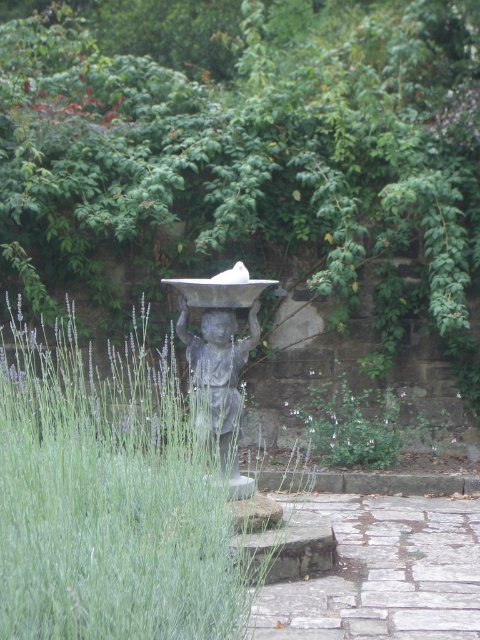
Who is taller, green grass at center or paved stone path at center?

green grass at center

Is point (96, 433) closer to viewer compared to point (414, 513)?

Yes.

Locate an element on the screen. The image size is (480, 640). green grass at center is located at coordinates (108, 497).

Who is positioned more to the right, bronze statue at center or green leafy plant at center?

green leafy plant at center is more to the right.

Does bronze statue at center appear over green leafy plant at center?

Indeed, bronze statue at center is positioned over green leafy plant at center.

Find the location of a particular element. The width and height of the screenshot is (480, 640). bronze statue at center is located at coordinates (220, 355).

Based on the photo, does green grass at center appear on the right side of green leafy plant at center?

No, green grass at center is not to the right of green leafy plant at center.

Is green grass at center above green leafy plant at center?

Yes, green grass at center is above green leafy plant at center.

Locate an element on the screen. green grass at center is located at coordinates (108, 497).